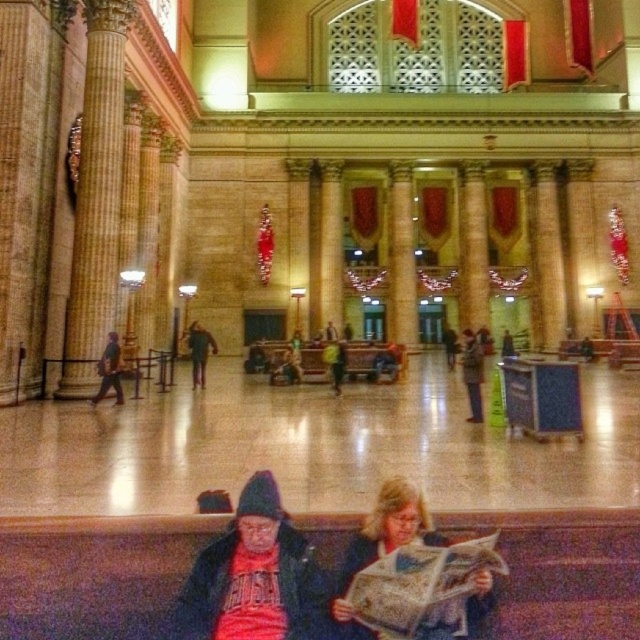
Question: Is red knit cap at lower center behind dark brown leather jacket at center?

Choices:
 (A) no
 (B) yes

Answer: (A)

Question: Among these points, which one is farthest from the camera?

Choices:
 (A) (337, 595)
 (B) (308, 548)

Answer: (B)

Question: Which object is the farthest from the dark brown leather jacket at center?

Choices:
 (A) matte black jacket at lower center
 (B) matte red shirt at lower center

Answer: (A)

Question: Is matte black jacket at lower center to the left of dark brown leather jacket at center from the viewer's perspective?

Choices:
 (A) yes
 (B) no

Answer: (B)

Question: Which of the following is the closest to the observer?

Choices:
 (A) (192, 580)
 (B) (202, 336)
 (C) (353, 563)
 (D) (260, 595)

Answer: (D)

Question: Does matte red shirt at lower center appear under dark brown leather jacket at center?

Choices:
 (A) yes
 (B) no

Answer: (A)